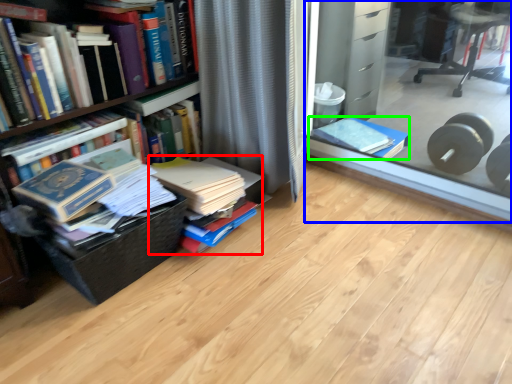
Question: Based on their relative distances, which object is farther from book (highlighted by a red box)? Choose from glass box (highlighted by a blue box) and book (highlighted by a green box).

Choices:
 (A) glass box
 (B) book

Answer: (A)